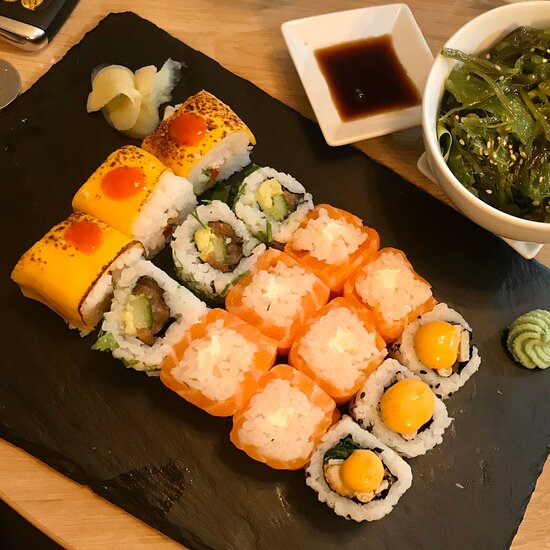
Image resolution: width=550 pixels, height=550 pixels. I want to click on wood table, so click(248, 43).